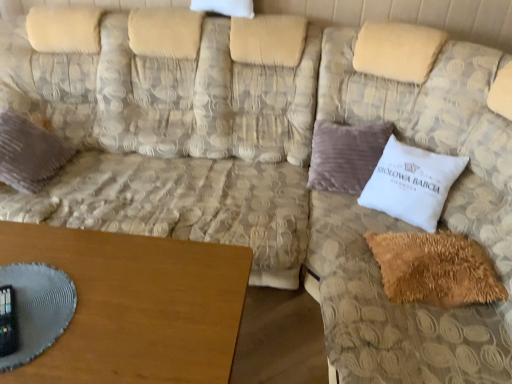
Question: Considering the relative positions of beige textured couch at upper right, positioned as the 1th couch in right-to-left order, and velvet purple pillow at left, which ranks as the first pillow in left-to-right order, in the image provided, is beige textured couch at upper right, positioned as the 1th couch in right-to-left order, to the right of velvet purple pillow at left, which ranks as the first pillow in left-to-right order, from the viewer's perspective?

Choices:
 (A) no
 (B) yes

Answer: (B)

Question: Is beige textured couch at upper right, marked as the 2th couch in a left-to-right arrangement, completely or partially outside of velvet purple pillow at left, which ranks as the first pillow in left-to-right order?

Choices:
 (A) no
 (B) yes

Answer: (B)

Question: Is beige textured couch at upper right, marked as the 2th couch in a left-to-right arrangement, further to the viewer compared to velvet purple pillow at left, which ranks as the first pillow in left-to-right order?

Choices:
 (A) yes
 (B) no

Answer: (B)

Question: From the image's perspective, is beige textured couch at upper right, marked as the 2th couch in a left-to-right arrangement, below velvet purple pillow at left, which ranks as the first pillow in left-to-right order?

Choices:
 (A) yes
 (B) no

Answer: (A)

Question: Can you confirm if beige textured couch at upper right, marked as the 2th couch in a left-to-right arrangement, is bigger than velvet purple pillow at left, which ranks as the first pillow in left-to-right order?

Choices:
 (A) no
 (B) yes

Answer: (B)

Question: Relative to white soft pillow at center right, placed as the first pillow when sorted from right to left, is beige textured couch at center, which appears as the first couch when viewed from the left, in front or behind?

Choices:
 (A) behind
 (B) front

Answer: (B)

Question: Is beige textured couch at center, which appears as the first couch when viewed from the left, taller or shorter than white soft pillow at center right, the third pillow from the left?

Choices:
 (A) short
 (B) tall

Answer: (B)

Question: Would you say beige textured couch at center, which appears as the first couch when viewed from the left, is to the left or to the right of white soft pillow at center right, placed as the first pillow when sorted from right to left, in the picture?

Choices:
 (A) left
 (B) right

Answer: (A)

Question: Is point (99, 139) positioned closer to the camera than point (437, 210)?

Choices:
 (A) closer
 (B) farther

Answer: (B)

Question: From the image's perspective, is white soft pillow at center right, the third pillow from the left, located above or below beige textured couch at center, which appears as the first couch when viewed from the left?

Choices:
 (A) above
 (B) below

Answer: (B)

Question: From a real-world perspective, is white soft pillow at center right, the third pillow from the left, above or below beige textured couch at center, the 2th couch when ordered from right to left?

Choices:
 (A) below
 (B) above

Answer: (A)

Question: Relative to beige textured couch at center, which appears as the first couch when viewed from the left, is white soft pillow at center right, the third pillow from the left, in front or behind?

Choices:
 (A) behind
 (B) front

Answer: (A)

Question: Is white soft pillow at center right, placed as the first pillow when sorted from right to left, bigger or smaller than beige textured couch at center, the 2th couch when ordered from right to left?

Choices:
 (A) big
 (B) small

Answer: (B)

Question: Is brown wooden table at lower left bigger or smaller than white soft pillow at center right, placed as the first pillow when sorted from right to left?

Choices:
 (A) small
 (B) big

Answer: (B)

Question: From a real-world perspective, is brown wooden table at lower left physically located above or below white soft pillow at center right, the third pillow from the left?

Choices:
 (A) above
 (B) below

Answer: (B)